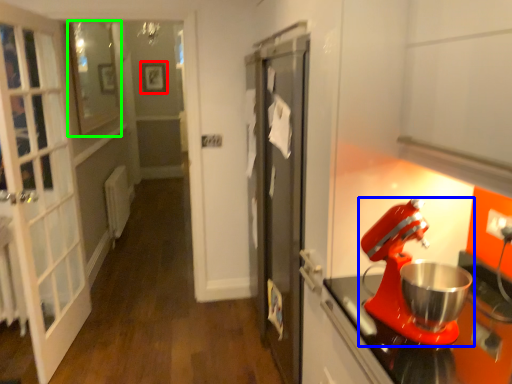
Question: Estimate the real-world distances between objects in this image. Which object is closer to picture frame (highlighted by a red box), mixer (highlighted by a blue box) or window (highlighted by a green box)?

Choices:
 (A) mixer
 (B) window

Answer: (B)